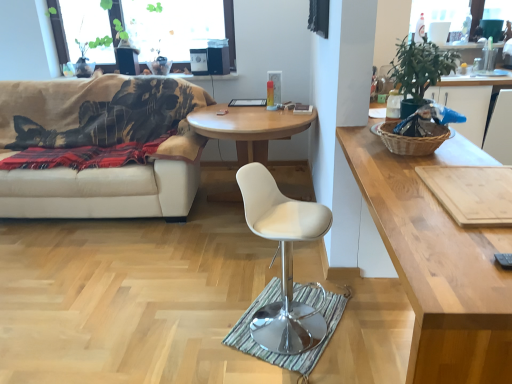
At what (x,y) coordinates should I click in order to perform the action: click on vacant space to the right of textured woven mat at center. Please return your answer as a coordinate pair (x, y). The height and width of the screenshot is (384, 512). Looking at the image, I should click on (371, 329).